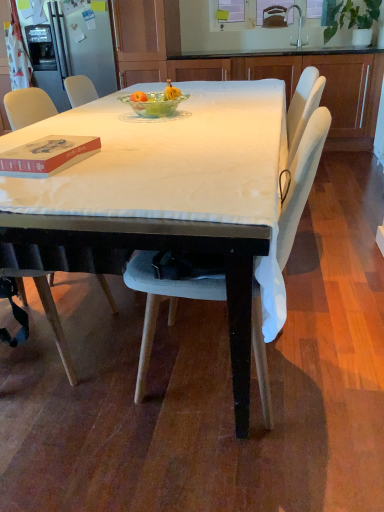
Question: Can you confirm if white fabric-covered table at center is shorter than silver metallic faucet at upper center?

Choices:
 (A) no
 (B) yes

Answer: (A)

Question: Is white fabric-covered table at center wider than silver metallic faucet at upper center?

Choices:
 (A) yes
 (B) no

Answer: (A)

Question: Does white fabric-covered table at center come behind silver metallic faucet at upper center?

Choices:
 (A) yes
 (B) no

Answer: (B)

Question: Can you confirm if white fabric-covered table at center is smaller than silver metallic faucet at upper center?

Choices:
 (A) no
 (B) yes

Answer: (A)

Question: Is white fabric-covered table at center oriented towards silver metallic faucet at upper center?

Choices:
 (A) yes
 (B) no

Answer: (B)

Question: Is white fabric-covered table at center in contact with silver metallic faucet at upper center?

Choices:
 (A) no
 (B) yes

Answer: (A)

Question: Could you tell me if green leafy plant at upper right is facing silver metallic faucet at upper center?

Choices:
 (A) no
 (B) yes

Answer: (A)

Question: Is green leafy plant at upper right facing away from silver metallic faucet at upper center?

Choices:
 (A) yes
 (B) no

Answer: (B)

Question: Is green leafy plant at upper right at the right side of silver metallic faucet at upper center?

Choices:
 (A) no
 (B) yes

Answer: (B)

Question: Considering the relative sizes of green leafy plant at upper right and silver metallic faucet at upper center in the image provided, is green leafy plant at upper right thinner than silver metallic faucet at upper center?

Choices:
 (A) no
 (B) yes

Answer: (A)

Question: Is green leafy plant at upper right not close to silver metallic faucet at upper center?

Choices:
 (A) yes
 (B) no

Answer: (B)

Question: Is green leafy plant at upper right to the left of silver metallic faucet at upper center from the viewer's perspective?

Choices:
 (A) yes
 (B) no

Answer: (B)

Question: Does silver metallic faucet at upper center come behind matte red book at left?

Choices:
 (A) no
 (B) yes

Answer: (B)